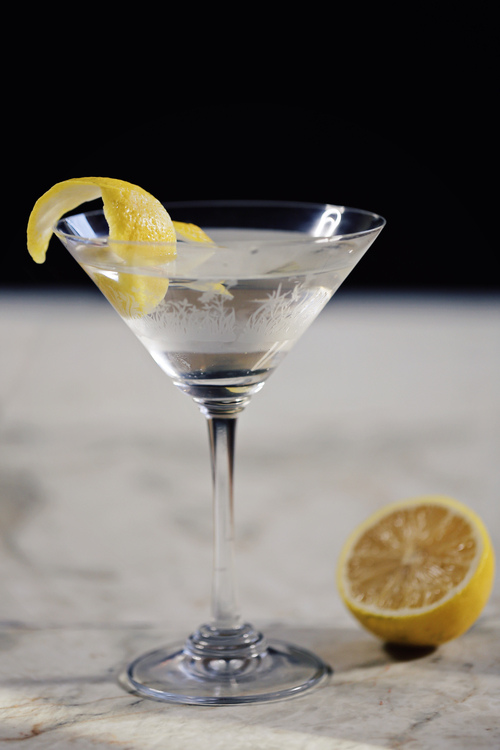
Where is `rim of the glass`? Image resolution: width=500 pixels, height=750 pixels. rim of the glass is located at coordinates (369, 226), (63, 220), (224, 241), (232, 200).